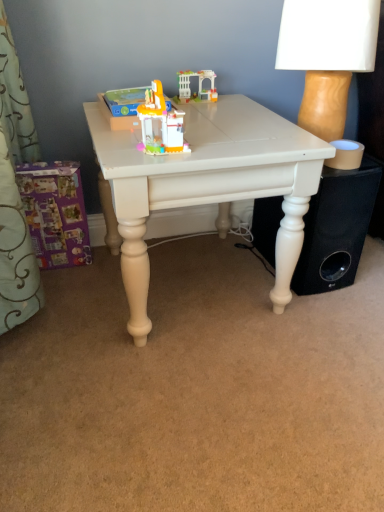
Locate an element on the screen. Image resolution: width=384 pixels, height=512 pixels. vacant area that lies to the right of translucent plastic toy at center, which is the 2th toy from right to left is located at coordinates (229, 142).